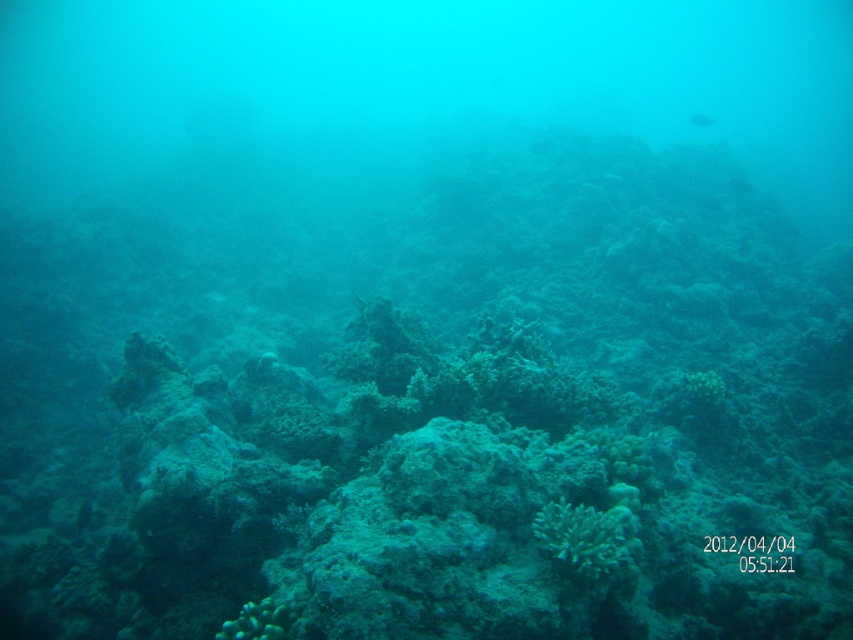
Between green matte coral at center and translucent greenish-blue fish at upper center, which one is positioned higher?

Positioned higher is translucent greenish-blue fish at upper center.

Can you confirm if green matte coral at center is positioned below translucent greenish-blue fish at upper center?

Indeed, green matte coral at center is positioned under translucent greenish-blue fish at upper center.

The width and height of the screenshot is (853, 640). What are the coordinates of `green matte coral at center` in the screenshot? It's located at (587, 536).

Locate an element on the screen. This screenshot has width=853, height=640. green matte coral at center is located at coordinates (587, 536).